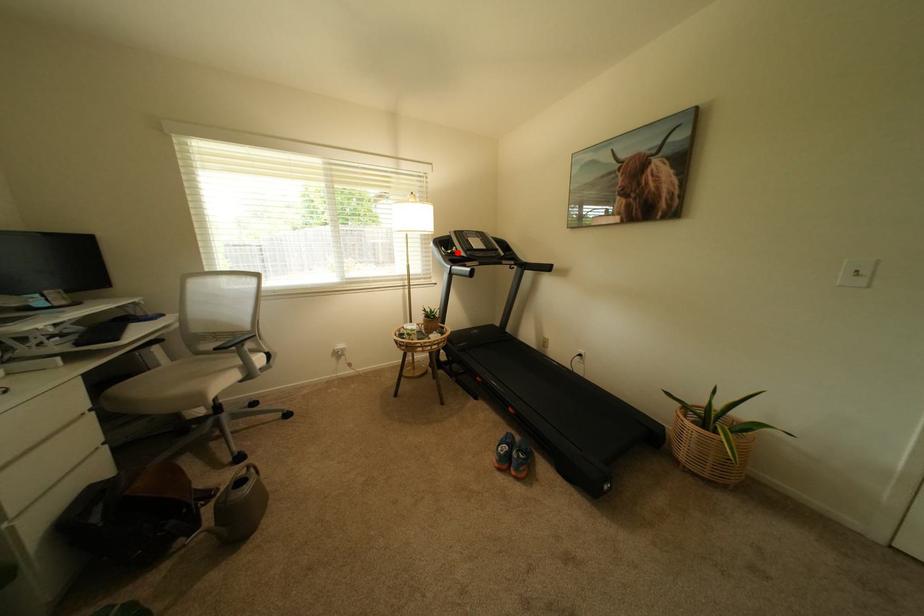
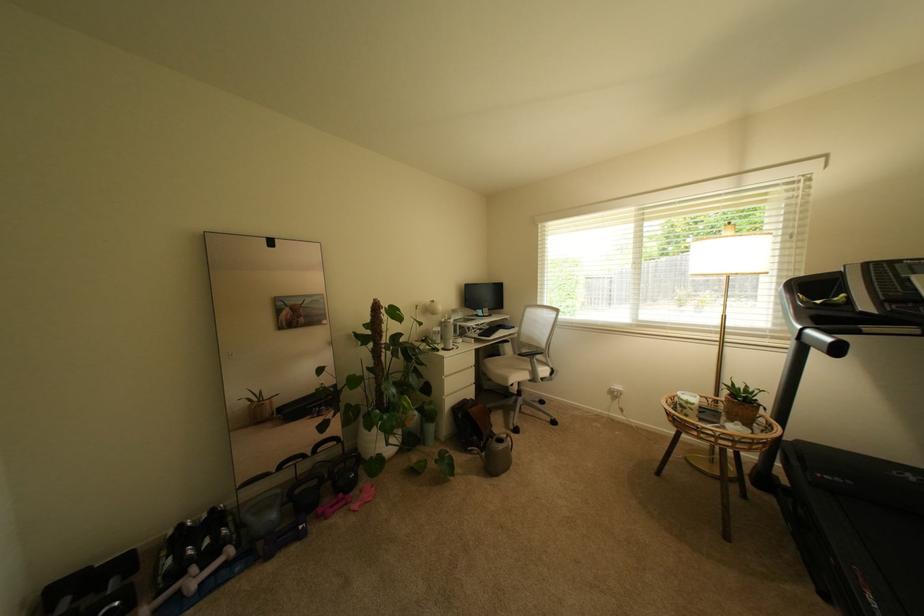
Locate, in the second image, the point that corresponds to the highlighted location in the first image.

(827, 302)